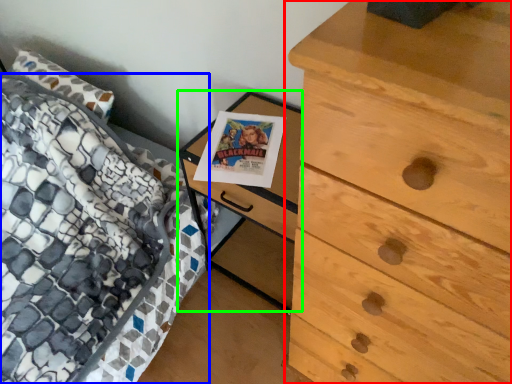
Question: Considering the real-world distances, which object is closest to chest of drawers (highlighted by a red box)? bed (highlighted by a blue box) or nightstand (highlighted by a green box).

Choices:
 (A) bed
 (B) nightstand

Answer: (B)